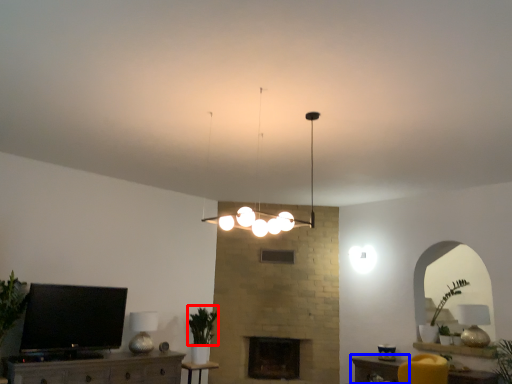
Question: Which point is further to the camera, plant (highlighted by a red box) or table (highlighted by a blue box)?

Choices:
 (A) plant
 (B) table

Answer: (A)